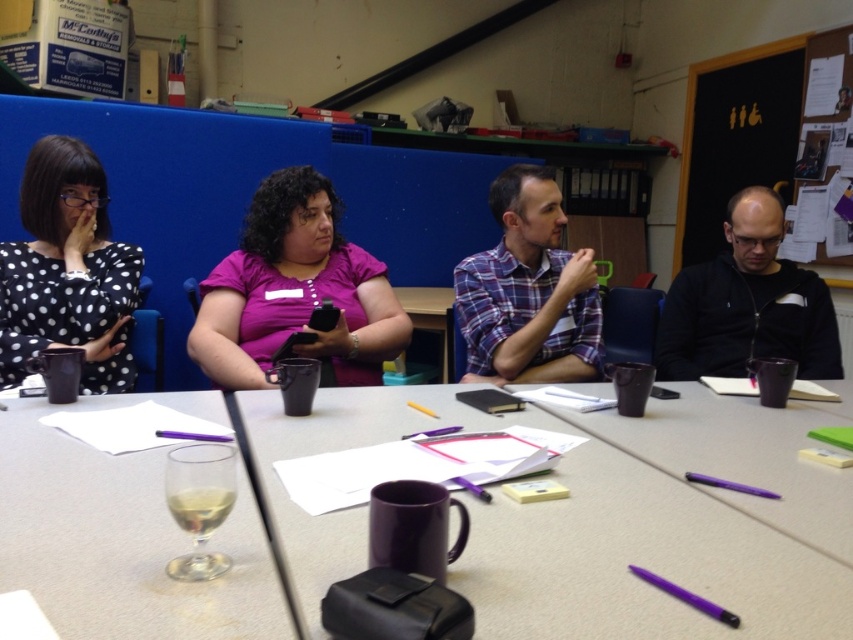
Question: Does clear glass at lower left appear under blackboard at right?

Choices:
 (A) yes
 (B) no

Answer: (A)

Question: Which object appears closest to the camera in this image?

Choices:
 (A) blackboard at right
 (B) black dotted dress at left
 (C) purple matte mug at center
 (D) purple matte pen at lower center

Answer: (D)

Question: Among these points, which one is farthest from the camera?

Choices:
 (A) (840, 472)
 (B) (714, 272)

Answer: (B)

Question: Based on their relative distances, which object is nearer to the purple matte mug at center?

Choices:
 (A) matte black mug at center
 (B) purple matte pen at lower center
 (C) clear glass at lower left

Answer: (B)

Question: Is clear glass at lower left in front of matte pink shirt at center?

Choices:
 (A) no
 (B) yes

Answer: (B)

Question: Can you confirm if matte black mug at center is wider than purple matte pen at lower center?

Choices:
 (A) no
 (B) yes

Answer: (B)